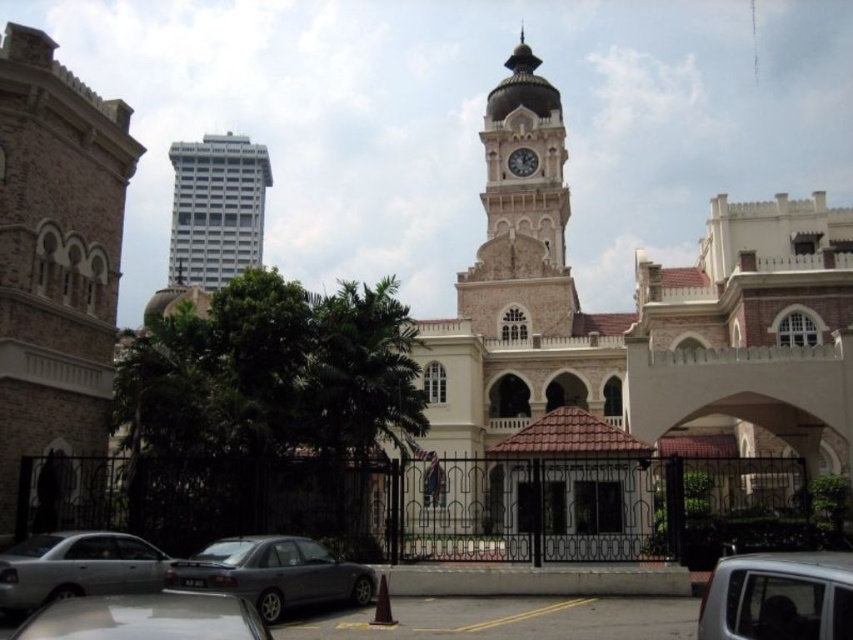
Looking at this image, you are standing at the entrance of the historic building and want to park your car near the black wrought iron gate. Is the silver metallic car at lower left blocking your parking spot?

The silver metallic car at lower left is located at point (76, 566), which is near the black wrought iron gate. Therefore, the silver metallic car at lower left is blocking your parking spot.

You are a photographer planning to take a wide shot of the white glossy building at upper left and the silver metallic car at lower left. Which object should you focus on first if you want to capture both in the same frame?

The white glossy building at upper left is bigger than the silver metallic car at lower left, so you should focus on the white glossy building at upper left first to ensure it is in sharp focus while the car will remain in the frame but slightly smaller.

You are a delivery person needing to park your 5.5 meter long truck between the silver metallic car at lower right and the silver metallic car at lower center. Can you fit your truck in that space?

The distance between the silver metallic car at lower right and the silver metallic car at lower center is 20.58 meters, which is more than enough to accommodate a 5.5 meter long truck.